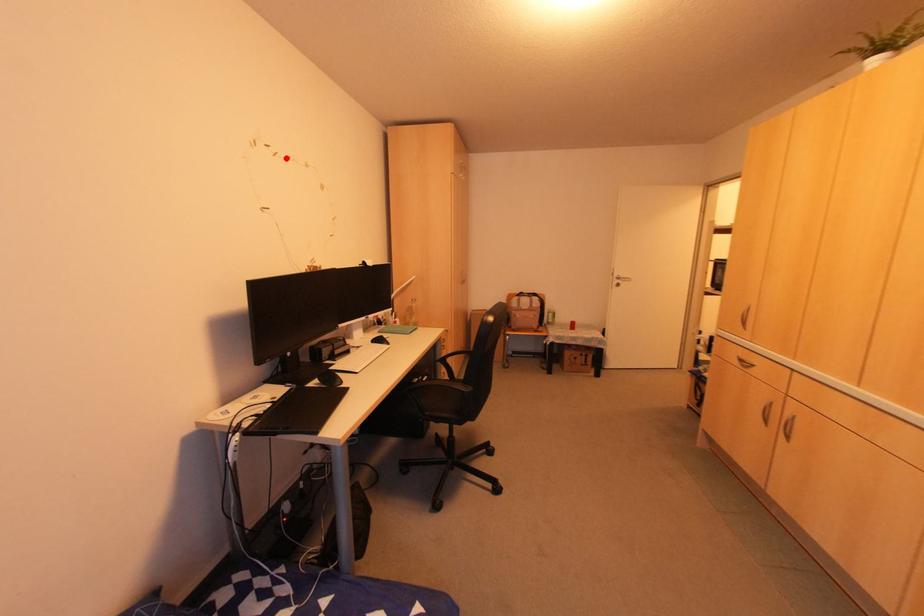
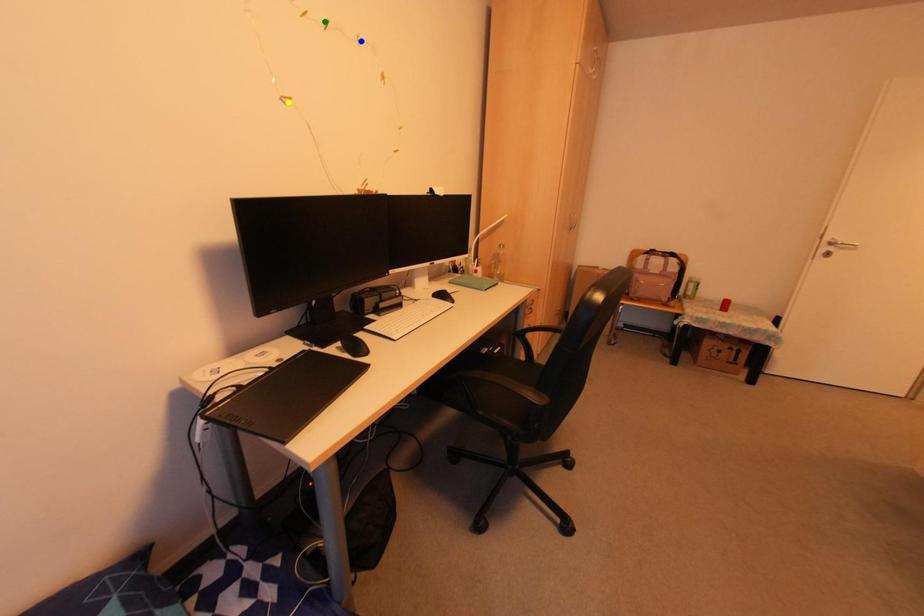
Question: I am providing you with two images of the same scene from different viewpoints. A red point is marked on the first image. You are given multiple points on the second image. Which point in image 2 represents the same 3d spot as the red point in image 1?

Choices:
 (A) blue point
 (B) yellow point
 (C) green point

Answer: (C)